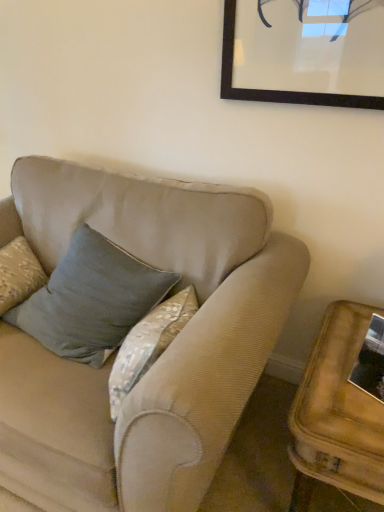
The height and width of the screenshot is (512, 384). Describe the element at coordinates (339, 410) in the screenshot. I see `wooden side table at lower right` at that location.

At what (x,y) coordinates should I click in order to perform the action: click on metallic reflective frame at lower right. Please return your answer as a coordinate pair (x, y). Image resolution: width=384 pixels, height=512 pixels. Looking at the image, I should click on (371, 361).

From a real-world perspective, is wooden side table at lower right above or below velvet blue pillow at center?

wooden side table at lower right is below velvet blue pillow at center.

Which is closer, (296, 441) or (116, 342)?

Point (296, 441) is closer to the camera than point (116, 342).

Is wooden side table at lower right surrounding velvet blue pillow at center?

No, velvet blue pillow at center is not surrounded by wooden side table at lower right.

Considering the sizes of objects wooden side table at lower right and velvet blue pillow at center in the image provided, who is shorter, wooden side table at lower right or velvet blue pillow at center?

wooden side table at lower right.

The image size is (384, 512). What are the coordinates of `picture frame behind the wooden side table at lower right` in the screenshot? It's located at (371, 361).

Which object is positioned more to the left, metallic reflective frame at lower right or wooden side table at lower right?

wooden side table at lower right is more to the left.

Relative to wooden side table at lower right, is metallic reflective frame at lower right in front or behind?

In the image, metallic reflective frame at lower right appears behind wooden side table at lower right.

Can you see velvet blue pillow at center touching metallic reflective frame at lower right?

They are not placed beside each other.

Looking at their sizes, would you say velvet blue pillow at center is wider or thinner than metallic reflective frame at lower right?

velvet blue pillow at center is wider than metallic reflective frame at lower right.

Does wooden side table at lower right turn towards metallic reflective frame at lower right?

No, wooden side table at lower right is not aimed at metallic reflective frame at lower right.

Is wooden side table at lower right situated inside metallic reflective frame at lower right or outside?

wooden side table at lower right cannot be found inside metallic reflective frame at lower right.

Considering the sizes of objects wooden side table at lower right and metallic reflective frame at lower right in the image provided, who is wider, wooden side table at lower right or metallic reflective frame at lower right?

wooden side table at lower right is wider.

Does wooden side table at lower right have a larger size compared to metallic reflective frame at lower right?

Yes, wooden side table at lower right is bigger than metallic reflective frame at lower right.

From the image's perspective, does metallic reflective frame at lower right appear lower than velvet blue pillow at center?

Indeed, from the image's perspective, metallic reflective frame at lower right is shown beneath velvet blue pillow at center.

Is metallic reflective frame at lower right wider than velvet blue pillow at center?

In fact, metallic reflective frame at lower right might be narrower than velvet blue pillow at center.

Consider the image. How distant is metallic reflective frame at lower right from velvet blue pillow at center?

The distance of metallic reflective frame at lower right from velvet blue pillow at center is 82.54 centimeters.

Between metallic reflective frame at lower right and velvet blue pillow at center, which one has less height?

metallic reflective frame at lower right is shorter.

Does velvet blue pillow at center lie behind wooden side table at lower right?

Yes.

Does velvet blue pillow at center have a lesser width compared to wooden side table at lower right?

Indeed, velvet blue pillow at center has a lesser width compared to wooden side table at lower right.

What's the angular difference between velvet blue pillow at center and wooden side table at lower right's facing directions?

They differ by 9.33 degrees in their facing directions.

This screenshot has height=512, width=384. In order to click on pillow that is above the wooden side table at lower right (from the image's perspective) in this screenshot , I will do `click(91, 298)`.

I want to click on pillow on the left of the wooden side table at lower right, so click(x=91, y=298).

Identify the location of table that is below the metallic reflective frame at lower right (from the image's perspective). This screenshot has height=512, width=384. (339, 410).

Which object lies nearer to the anchor point metallic reflective frame at lower right, wooden side table at lower right or velvet blue pillow at center?

The object closer to metallic reflective frame at lower right is wooden side table at lower right.

From the image, which object appears to be farther from wooden side table at lower right, velvet blue pillow at center or metallic reflective frame at lower right?

Based on the image, velvet blue pillow at center appears to be further to wooden side table at lower right.

Based on their spatial positions, is velvet blue pillow at center or wooden side table at lower right closer to metallic reflective frame at lower right?

wooden side table at lower right lies closer to metallic reflective frame at lower right than the other object.

Which object lies further to the anchor point velvet blue pillow at center, metallic reflective frame at lower right or wooden side table at lower right?

metallic reflective frame at lower right.

Considering their positions, is wooden side table at lower right positioned further to velvet blue pillow at center than metallic reflective frame at lower right?

metallic reflective frame at lower right is further to velvet blue pillow at center.

Estimate the real-world distances between objects in this image. Which object is closer to wooden side table at lower right, metallic reflective frame at lower right or velvet blue pillow at center?

metallic reflective frame at lower right is positioned closer to the anchor wooden side table at lower right.

Where is `table between velvet blue pillow at center and metallic reflective frame at lower right from left to right`? table between velvet blue pillow at center and metallic reflective frame at lower right from left to right is located at coordinates (339, 410).